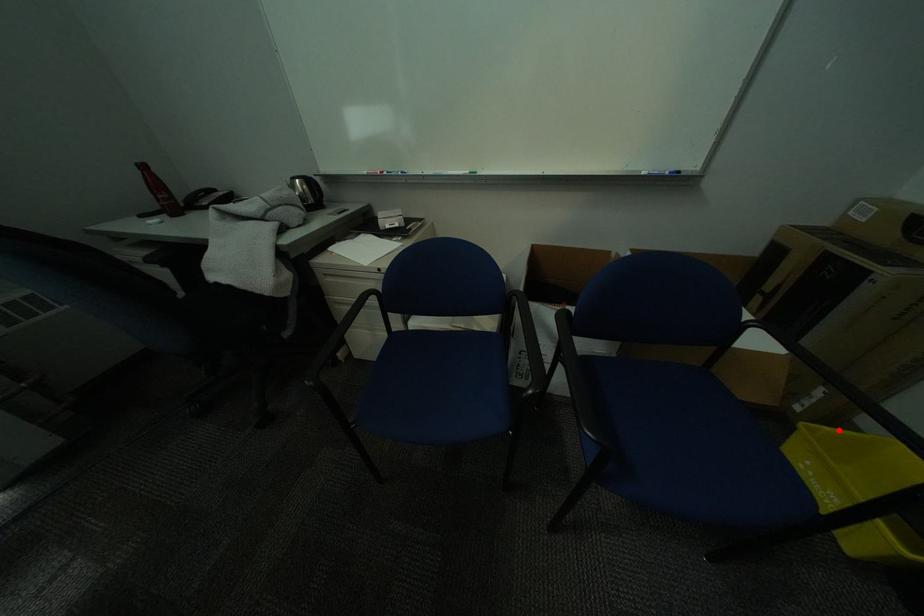
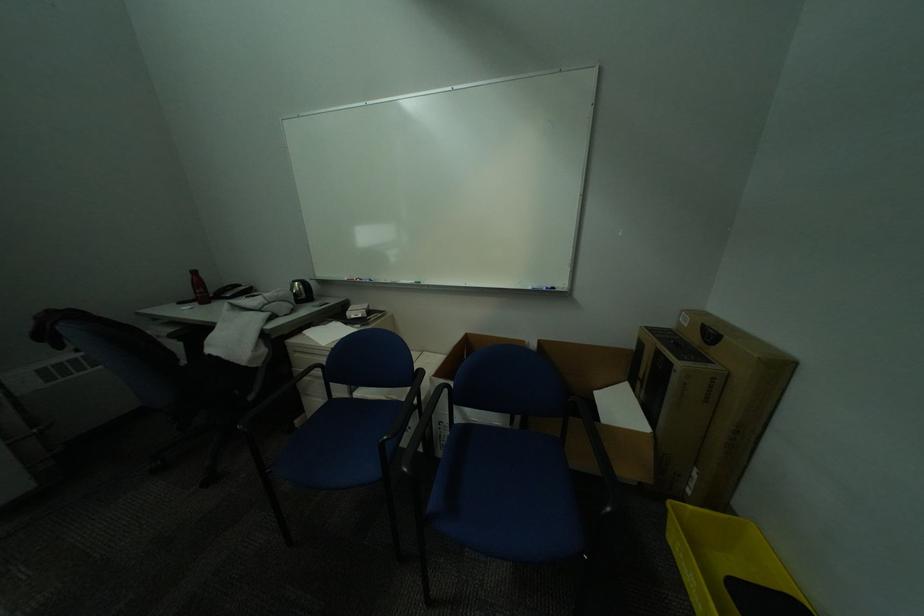
Question: I am providing you with two images of the same scene from different viewpoints. In image1, a red point is highlighted. Considering the same 3D point in image2, which of the following is correct?

Choices:
 (A) It is closer
 (B) It is farther

Answer: (A)